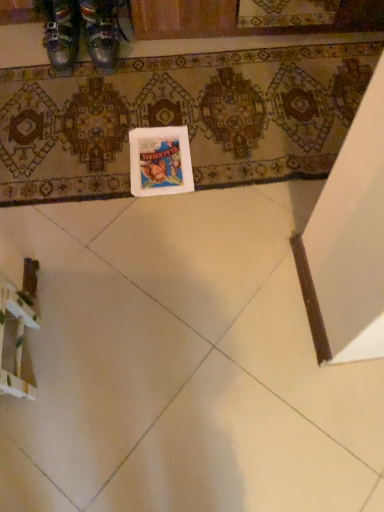
Question: Based on their sizes in the image, would you say metallic leather shoes at upper left, which ranks as the second footwear in right-to-left order, is bigger or smaller than white matte postcard at center?

Choices:
 (A) small
 (B) big

Answer: (B)

Question: Relative to white matte postcard at center, is metallic leather shoes at upper left, which ranks as the second footwear in right-to-left order, in front or behind?

Choices:
 (A) behind
 (B) front

Answer: (A)

Question: Which is nearer to the patterned carpet at center?

Choices:
 (A) white matte postcard at center
 (B) white glossy tile at lower left
 (C) metallic leather shoes at upper left, which ranks as the second footwear in right-to-left order
 (D) metallic leather shoes at upper left, the 1th footwear from the right

Answer: (A)

Question: Estimate the real-world distances between objects in this image. Which object is closer to the metallic leather shoes at upper left, the 1th footwear from the right?

Choices:
 (A) patterned carpet at center
 (B) white matte postcard at center
 (C) metallic leather shoes at upper left, which is counted as the first footwear, starting from the left
 (D) white glossy tile at lower left

Answer: (C)